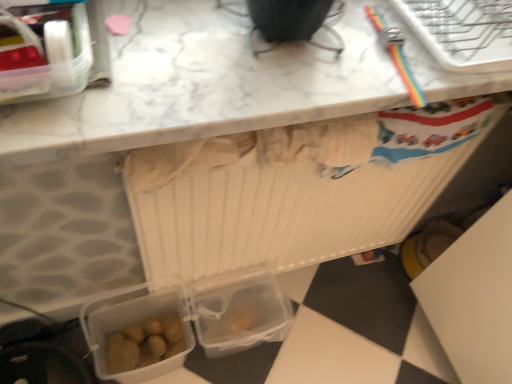
Where is `free point above white marble countertop at upper center (from a real-world perspective)`? free point above white marble countertop at upper center (from a real-world perspective) is located at coordinates (306, 41).